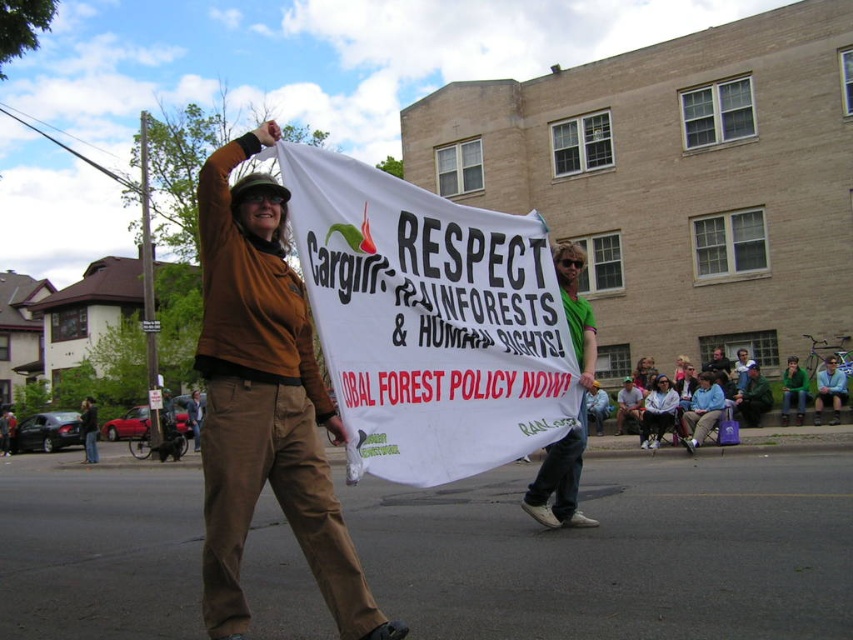
Question: Which object is the farthest from the brown leather jacket at center?

Choices:
 (A) white paper banner at center
 (B) blue denim jeans at lower right

Answer: (A)

Question: Considering the real-world distances, which object is farthest from the white paper banner at center?

Choices:
 (A) green fuzzy sweater at lower right
 (B) blue denim jeans at lower right
 (C) brown fabric pants at center
 (D) green fabric shirt at center

Answer: (A)

Question: Where is blue denim jeans at lower right located in relation to green fuzzy sweater at lower right in the image?

Choices:
 (A) left
 (B) right

Answer: (B)

Question: Which point appears farthest from the camera in this image?

Choices:
 (A) (82, 406)
 (B) (367, 624)
 (C) (801, 406)
 (D) (323, 234)

Answer: (A)

Question: Can you confirm if green fabric shirt at center is wider than green fuzzy sweater at lower right?

Choices:
 (A) yes
 (B) no

Answer: (B)

Question: Can you confirm if white paper banner at center is smaller than green fabric shirt at center?

Choices:
 (A) no
 (B) yes

Answer: (A)